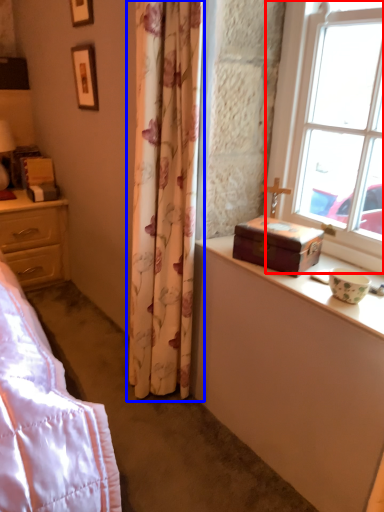
Question: Which of the following is the farthest to the observer, window (highlighted by a red box) or curtain (highlighted by a blue box)?

Choices:
 (A) window
 (B) curtain

Answer: (B)